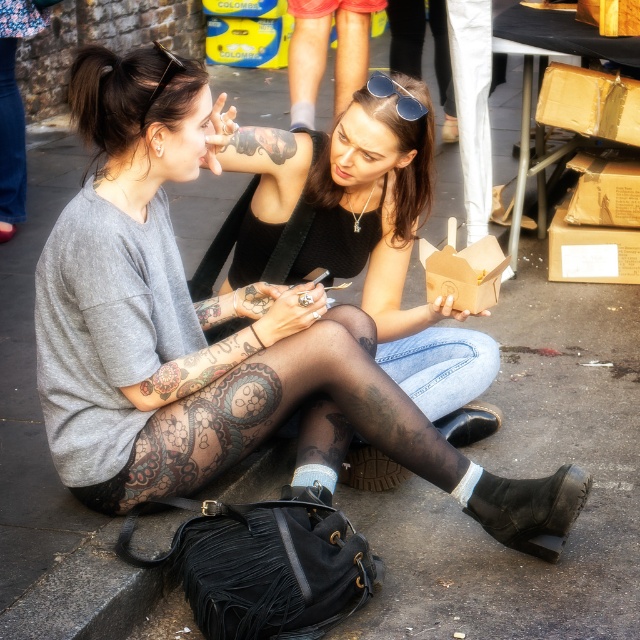
What do you see at coordinates (218, 339) in the screenshot? I see `matte black leggings at center` at bounding box center [218, 339].

Can you confirm if matte black leggings at center is positioned above sunglasses at center?

No, matte black leggings at center is not above sunglasses at center.

Who is more distant from viewer, (x=122, y=221) or (x=410, y=108)?

Positioned behind is point (x=410, y=108).

Locate an element on the screen. Image resolution: width=640 pixels, height=640 pixels. matte black leggings at center is located at coordinates (218, 339).

Does black matte tights at center have a lesser height compared to sunglasses at center?

Incorrect, black matte tights at center's height does not fall short of sunglasses at center's.

Who is positioned more to the left, black matte tights at center or sunglasses at center?

black matte tights at center is more to the left.

Who is more distant from viewer, [268,272] or [408,120]?

The point [268,272] is more distant.

Where is `black matte tights at center`? black matte tights at center is located at coordinates (355, 237).

Is matte black leggings at center smaller than black matte tattoo at upper center?

Actually, matte black leggings at center might be larger than black matte tattoo at upper center.

From the picture: Who is more distant from viewer, [202,451] or [259,134]?

Point [259,134]

Between point (204, 147) and point (234, 132), which one is positioned in front?

Point (204, 147) is in front.

Find the location of a particular element. This screenshot has width=640, height=640. matte black leggings at center is located at coordinates (218, 339).